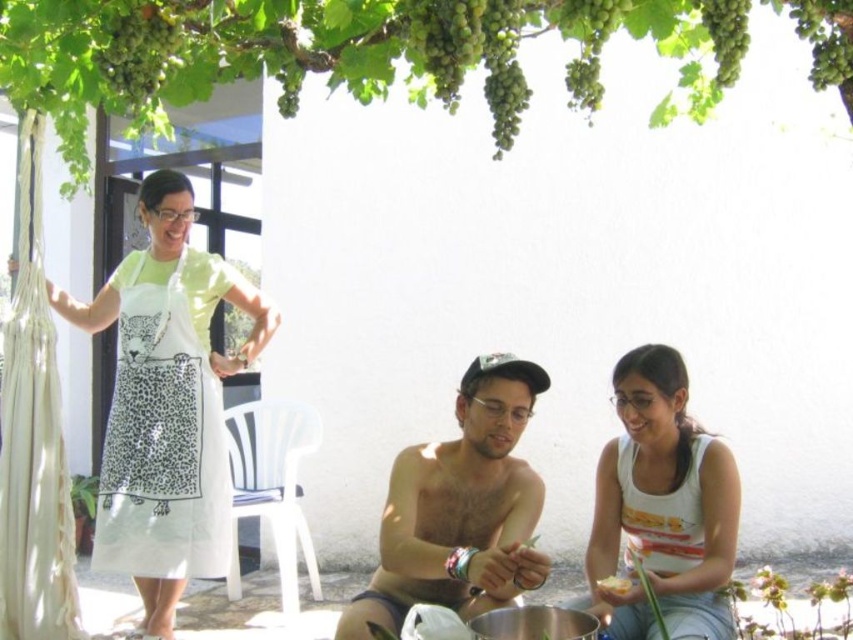
Question: Which point is farther to the camera?

Choices:
 (A) [x=601, y=516]
 (B) [x=129, y=554]
 (C) [x=602, y=577]
 (D) [x=457, y=90]

Answer: (D)

Question: Does shiny metallic cap at center have a larger size compared to white cotton tank top at center?

Choices:
 (A) yes
 (B) no

Answer: (A)

Question: Is green leafy tree at upper center positioned behind white fabric apron at left?

Choices:
 (A) yes
 (B) no

Answer: (B)

Question: Which of the following is the closest to the observer?

Choices:
 (A) [x=598, y=22]
 (B) [x=387, y=620]
 (C) [x=161, y=589]

Answer: (A)

Question: Among these objects, which one is farthest from the camera?

Choices:
 (A) white cotton tank top at center
 (B) white apron at left
 (C) yellow matte leaf at lower center

Answer: (B)

Question: Observing the image, what is the correct spatial positioning of green leafy tree at upper center in reference to white cotton tank top at center?

Choices:
 (A) left
 (B) right

Answer: (A)